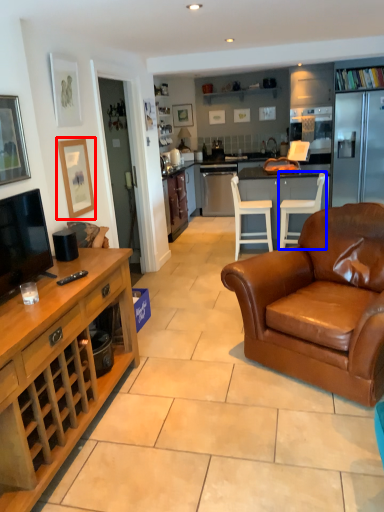
Question: Among these objects, which one is farthest to the camera, picture frame (highlighted by a red box) or chair (highlighted by a blue box)?

Choices:
 (A) picture frame
 (B) chair

Answer: (B)